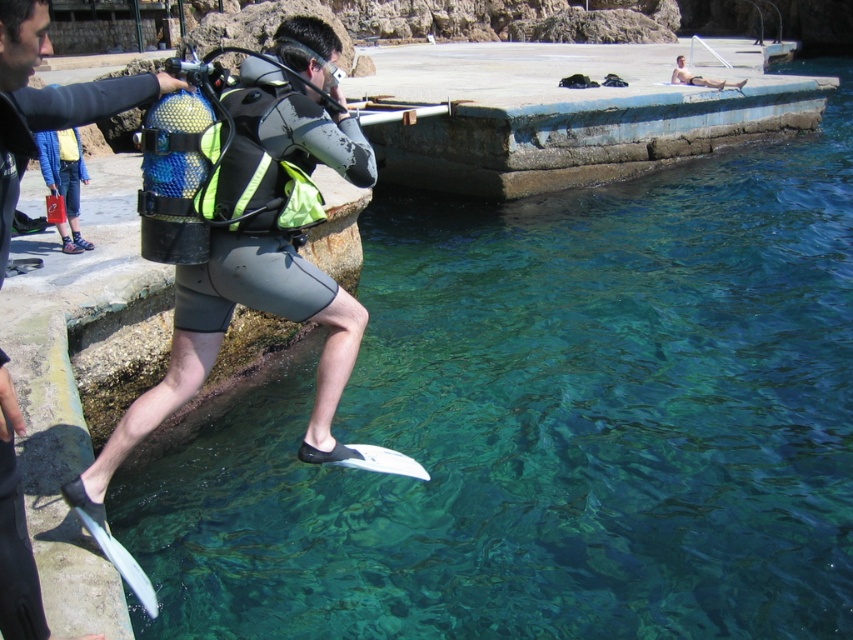
Does point (341, 99) come farther from viewer compared to point (685, 72)?

No, it is in front of (685, 72).

Is matte black diving suit at center further to camera compared to matte black wetsuit at upper center?

That is False.

Identify the location of matte black diving suit at center. (253, 275).

Who is more distant from viewer, (334, 452) or (370, 461)?

Positioned behind is point (370, 461).

Image resolution: width=853 pixels, height=640 pixels. What do you see at coordinates (253, 275) in the screenshot?
I see `matte black diving suit at center` at bounding box center [253, 275].

Locate an element on the screen. matte black diving suit at center is located at coordinates (253, 275).

Does matte black fins at lower left lie behind matte black wetsuit at upper center?

No.

Who is positioned more to the right, matte black fins at lower left or matte black wetsuit at upper center?

matte black wetsuit at upper center

Is point (10, 170) less distant than point (670, 80)?

Yes, it is.

I want to click on matte black fins at lower left, so click(47, 99).